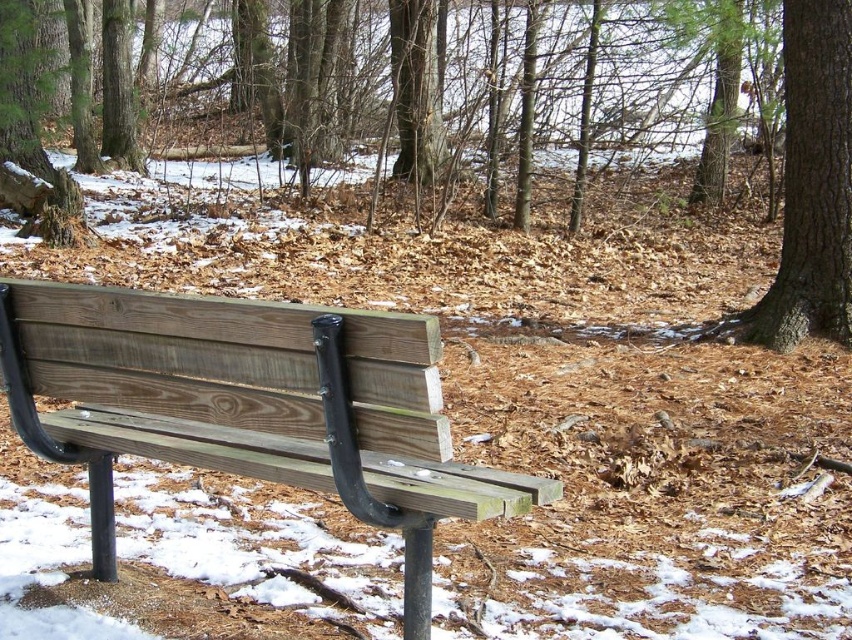
Between point (320, 337) and point (835, 301), which one is positioned behind?

The point (835, 301) is behind.

Who is more forward, (53, 448) or (786, 131)?

Point (53, 448) is in front.

Image resolution: width=852 pixels, height=640 pixels. I want to click on wooden bench at center, so click(x=250, y=406).